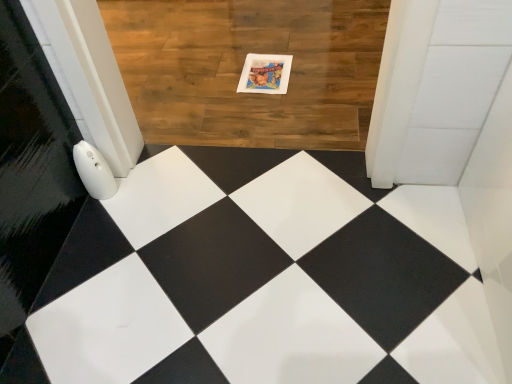
In order to click on vacant region in front of matte paper postcard at center in this screenshot , I will do `click(269, 106)`.